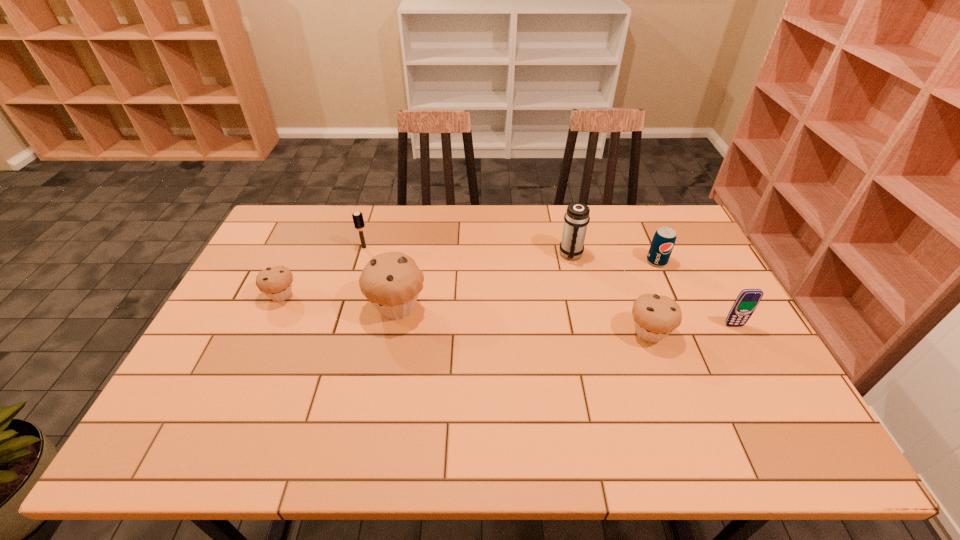
Identify the location of the leftmost muffin. (276, 282).

You are a GUI agent. You are given a task and a screenshot of the screen. Output one action in this format:
    pyautogui.click(x=<x>, y=<y>)
    Task: Click on the leftmost object
    
    Given the screenshot: What is the action you would take?
    pyautogui.click(x=276, y=282)

This screenshot has height=540, width=960. Find the location of `the second muffin from right to left`. the second muffin from right to left is located at coordinates click(391, 281).

The height and width of the screenshot is (540, 960). I want to click on the tallest muffin, so click(391, 281).

You are a GUI agent. You are given a task and a screenshot of the screen. Output one action in this format:
    pyautogui.click(x=<x>, y=<y>)
    Task: Click on the rightmost muffin
    
    Given the screenshot: What is the action you would take?
    pyautogui.click(x=655, y=316)

The width and height of the screenshot is (960, 540). In order to click on the second tallest muffin in this screenshot , I will do 655,316.

Image resolution: width=960 pixels, height=540 pixels. In order to click on hairbrush in this screenshot , I will do `click(358, 220)`.

You are a GUI agent. You are given a task and a screenshot of the screen. Output one action in this format:
    pyautogui.click(x=<x>, y=<y>)
    Task: Click on the thermos bottle
    The image size is (960, 540).
    Given the screenshot: What is the action you would take?
    pyautogui.click(x=576, y=218)

Identify the location of the sixth object from left to right. Image resolution: width=960 pixels, height=540 pixels. (664, 239).

At what (x,y) coordinates should I click in order to perform the action: click on cellular telephone. Please return your answer as a coordinate pair (x, y). Image resolution: width=960 pixels, height=540 pixels. Looking at the image, I should click on (745, 304).